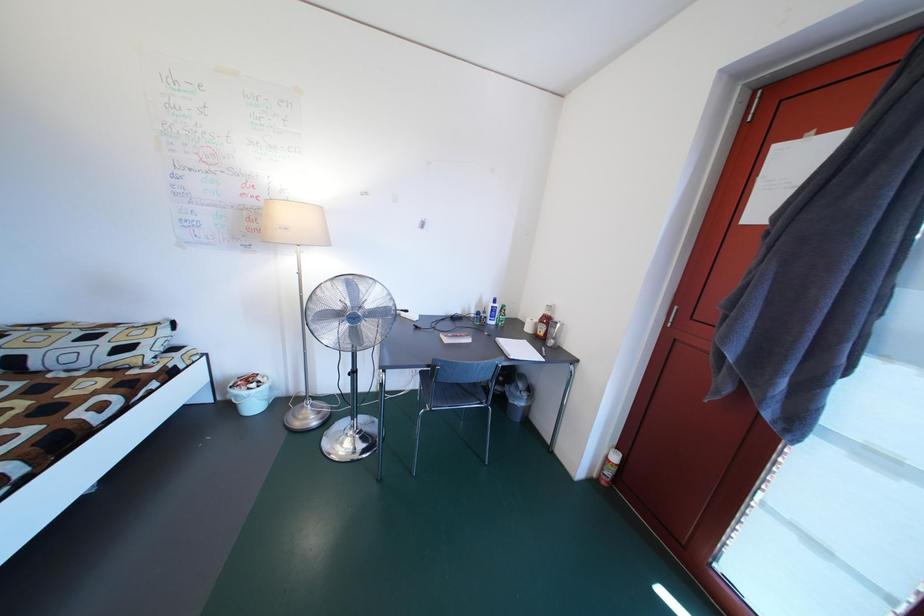
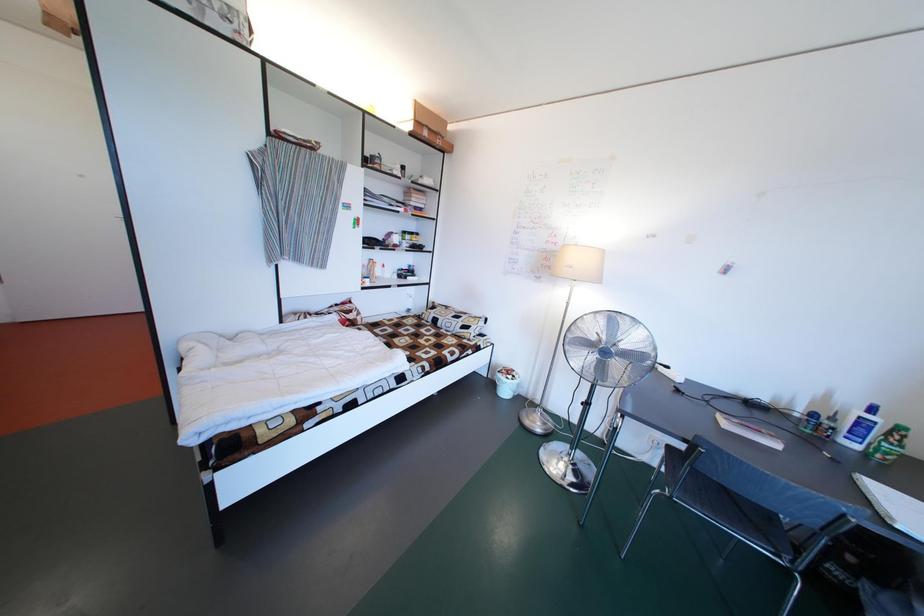
Question: How did the camera likely rotate?

Choices:
 (A) Left
 (B) Right
 (C) Up
 (D) Down

Answer: (A)